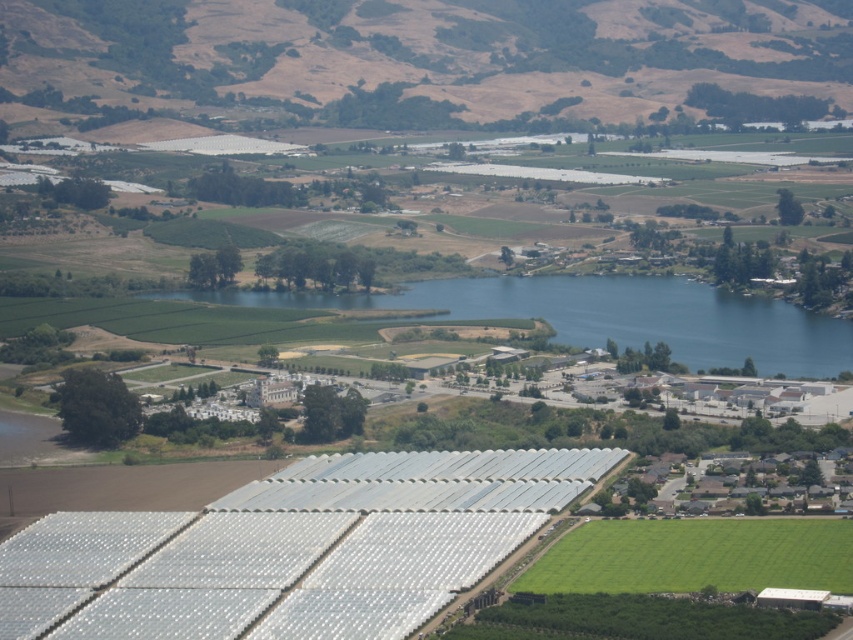
Who is shorter, brown/dry grass at upper center or blue water at center?

blue water at center is shorter.

Which is behind, point (479, 13) or point (822, 324)?

The point (822, 324) is behind.

You are a GUI agent. You are given a task and a screenshot of the screen. Output one action in this format:
    pyautogui.click(x=<x>, y=<y>)
    Task: Click on the brown/dry grass at upper center
    This screenshot has width=853, height=640.
    Given the screenshot: What is the action you would take?
    pyautogui.click(x=426, y=60)

Locate an element on the screen. This screenshot has width=853, height=640. brown/dry grass at upper center is located at coordinates (426, 60).